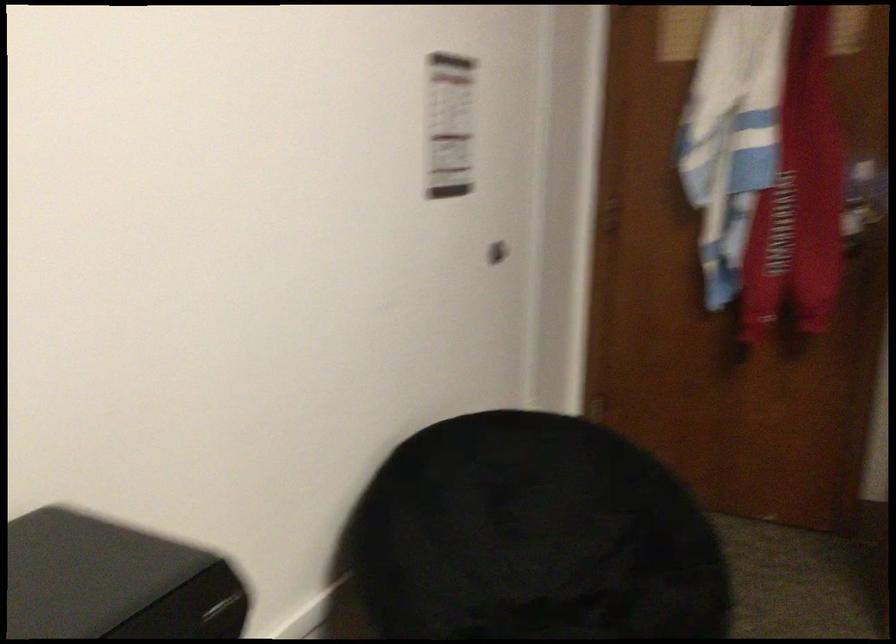
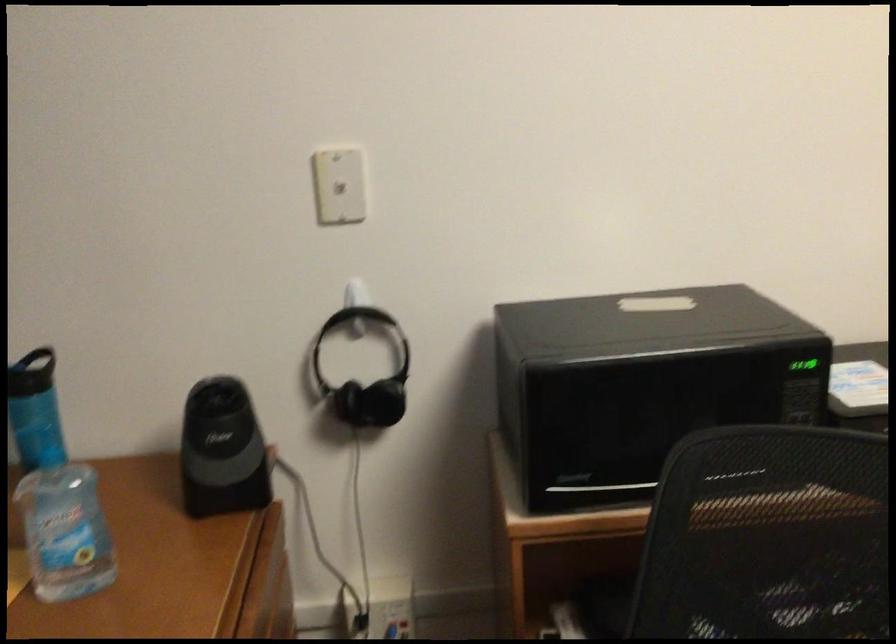
Question: The camera is either moving clockwise (left) or counter-clockwise (right) around the object. The first image is from the beginning of the video and the second image is from the end. Is the camera moving left or right when shooting the video?

Choices:
 (A) Left
 (B) Right

Answer: (B)